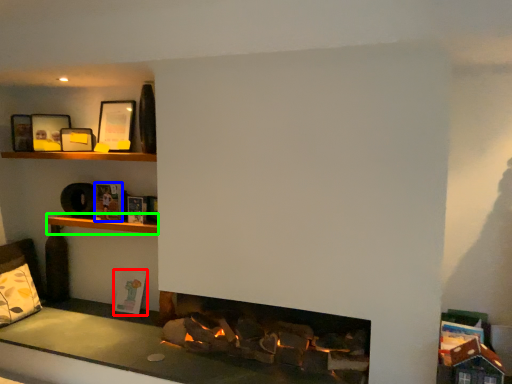
Question: Which is nearer to the book (highlighted by a red box)? book (highlighted by a blue box) or shelf (highlighted by a green box).

Choices:
 (A) book
 (B) shelf

Answer: (B)